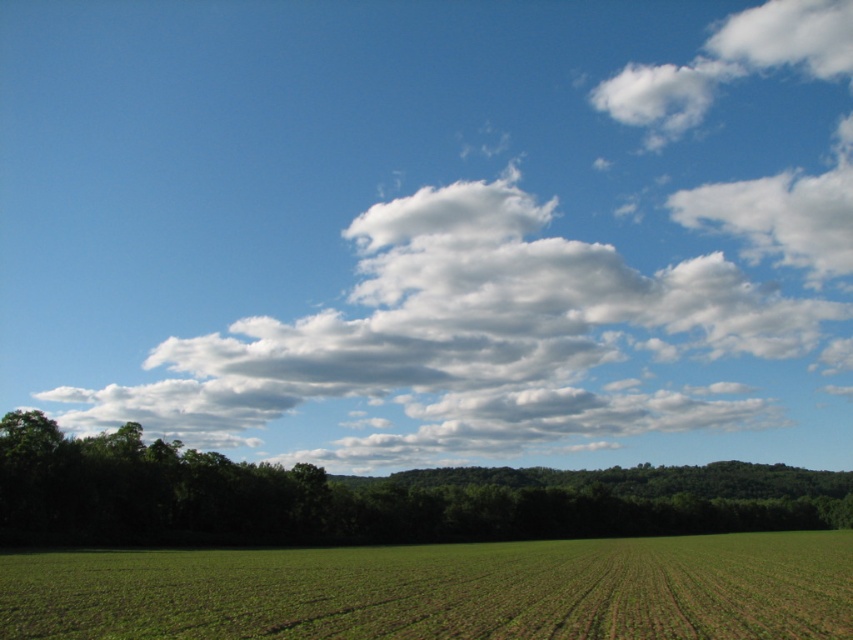
You are a farmer standing in the middle of your field and you notice the green leafy tree at lower center and the white fluffy cloud at upper right. How far apart are these two objects from each other?

The green leafy tree at lower center and the white fluffy cloud at upper right are 212.91 meters apart.

Looking at this image, you are a farmer standing in the middle of your field and you see the green leafy tree at lower center and the white fluffy cloud at upper right. Which object is closer to you?

The green leafy tree at lower center is closer to you because it is positioned below the white fluffy cloud at upper right, indicating it is in the foreground of the scene.

You are a farmer standing in the middle of your field and you notice the green grass at lower center and the white fluffy cloud at upper right. Which object is closer to you?

The green grass at lower center is closer to you because it is positioned under the white fluffy cloud at upper right, which is farther away in the sky.